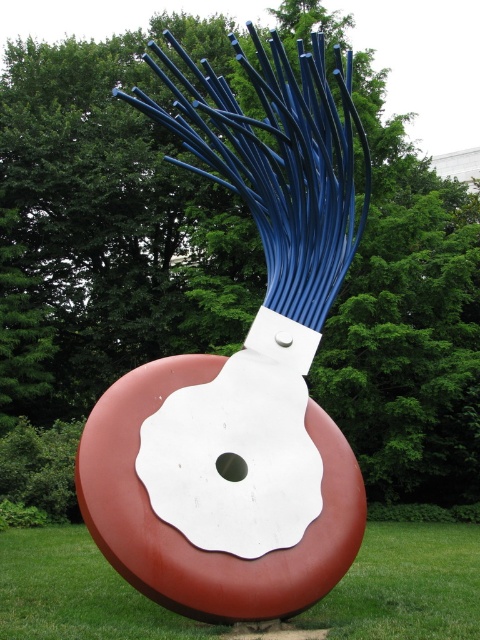
Question: Which of the following is the farthest from the observer?

Choices:
 (A) green grass at lower center
 (B) matte blue wire at center

Answer: (B)

Question: Is matte blue wire at center thinner than green grass at lower center?

Choices:
 (A) yes
 (B) no

Answer: (A)

Question: Is matte blue wire at center to the right of green grass at lower center from the viewer's perspective?

Choices:
 (A) yes
 (B) no

Answer: (A)

Question: Which of the following is the closest to the observer?

Choices:
 (A) matte blue wire at center
 (B) green grass at lower center

Answer: (B)

Question: Which point is closer to the camera?

Choices:
 (A) (282, 292)
 (B) (442, 620)

Answer: (B)

Question: Considering the relative positions of matte blue wire at center and green grass at lower center in the image provided, where is matte blue wire at center located with respect to green grass at lower center?

Choices:
 (A) left
 (B) right

Answer: (B)